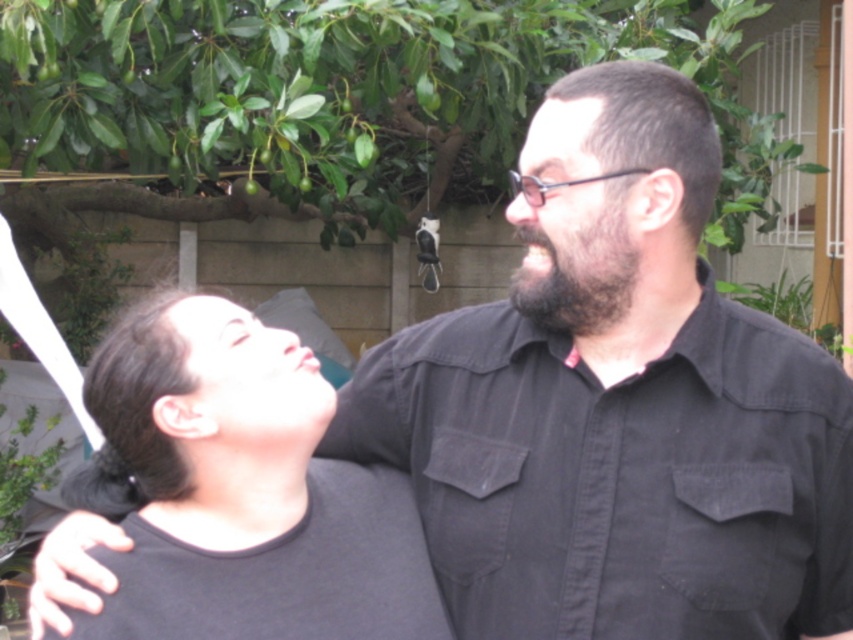
You are a photographer trying to capture a candid shot of the two people in the scene. You want to ensure that the black cotton shirt at center and the dark brown fuzzy beard at center are both clearly visible in your photo. Based on their positions, which object should you focus on first to ensure both are in frame?

The dark brown fuzzy beard at center should be focused on first because the black cotton shirt at center is to the right of it. By centering the beard in your viewfinder, you can adjust the frame to include both the beard and the shirt to its right.

You are a photographer trying to capture a candid shot of the two people in the scene. You notice the black cotton shirt at center and the dark gray shirt at center. Which shirt should you focus on if you want to ensure the subject with the larger shirt is in the frame?

The black cotton shirt at center is bigger than the dark gray shirt at center, so focusing on the black cotton shirt at center will ensure the larger shirt is in the frame.